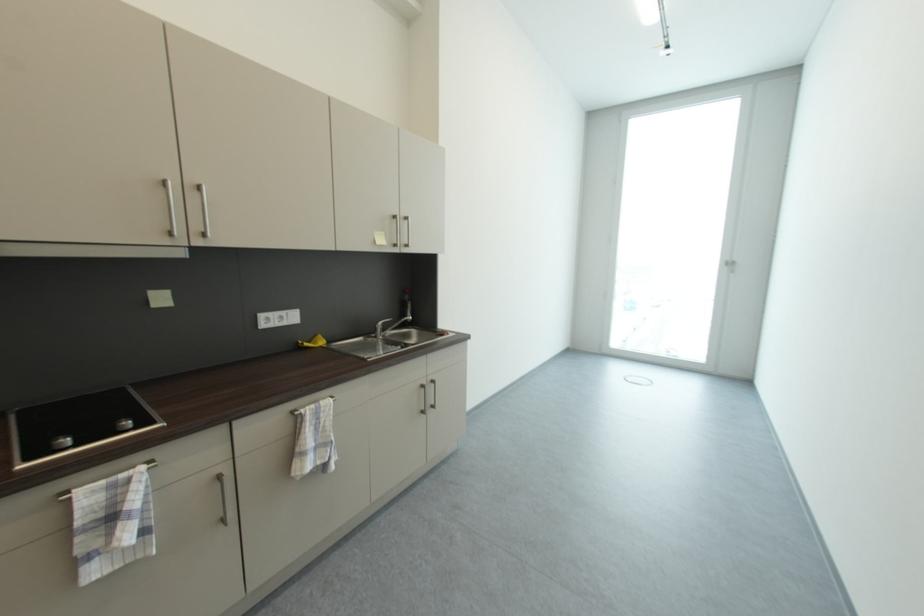
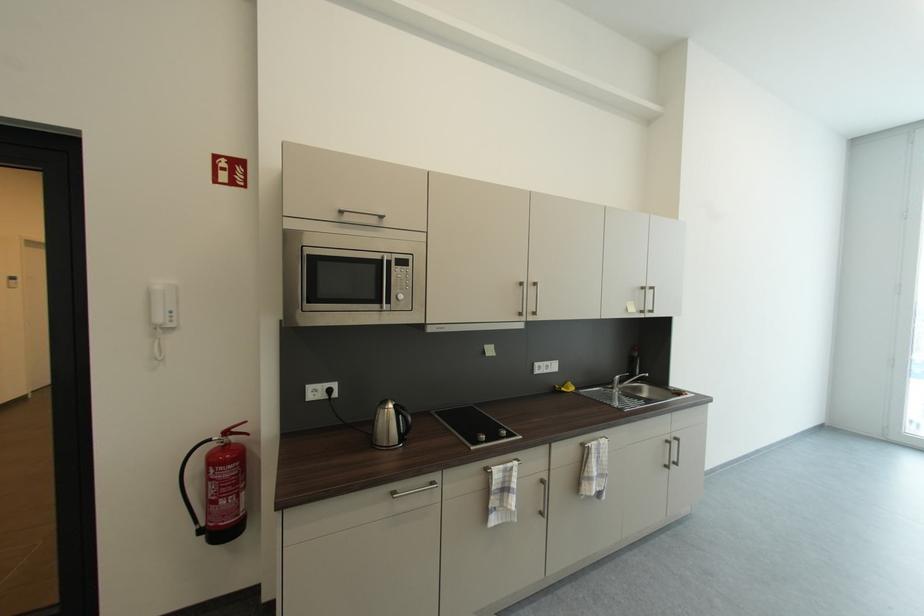
Find the pixel in the second image that matches point (431, 384) in the first image.

(675, 440)